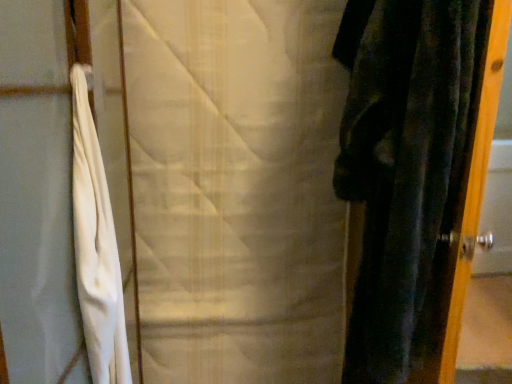
Question: Based on their sizes in the image, would you say velvet dark green curtain at right, the second curtain from the left, is bigger or smaller than white textured fabric at center, the second curtain when ordered from right to left?

Choices:
 (A) big
 (B) small

Answer: (B)

Question: From a real-world perspective, relative to white textured fabric at center, which ranks as the 1th curtain in left-to-right order, is velvet dark green curtain at right, the second curtain from the left, vertically above or below?

Choices:
 (A) below
 (B) above

Answer: (B)

Question: Is velvet dark green curtain at right, which is the 1th curtain from right to left, in front of or behind white textured fabric at center, which ranks as the 1th curtain in left-to-right order, in the image?

Choices:
 (A) front
 (B) behind

Answer: (A)

Question: Looking at their shapes, would you say white textured fabric at center, the second curtain when ordered from right to left, is wider or thinner than velvet dark green curtain at right, which is the 1th curtain from right to left?

Choices:
 (A) wide
 (B) thin

Answer: (B)

Question: In terms of height, does white textured fabric at center, which ranks as the 1th curtain in left-to-right order, look taller or shorter compared to velvet dark green curtain at right, the second curtain from the left?

Choices:
 (A) short
 (B) tall

Answer: (A)

Question: From a real-world perspective, relative to velvet dark green curtain at right, the second curtain from the left, is white textured fabric at center, the second curtain when ordered from right to left, vertically above or below?

Choices:
 (A) below
 (B) above

Answer: (A)

Question: Which is correct: white textured fabric at center, the second curtain when ordered from right to left, is inside velvet dark green curtain at right, which is the 1th curtain from right to left, or outside of it?

Choices:
 (A) inside
 (B) outside

Answer: (B)